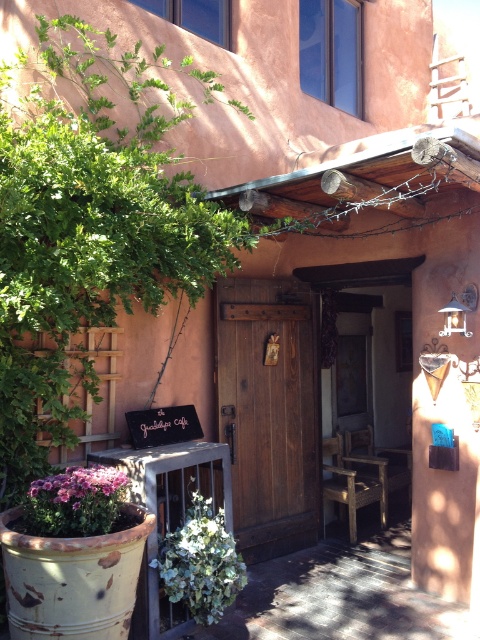
Does point (216, 282) come farther from viewer compared to point (28, 504)?

Yes, point (216, 282) is farther from viewer.

Where is `rustic wood door at center`? The image size is (480, 640). rustic wood door at center is located at coordinates (268, 412).

Who is more distant from viewer, (287, 531) or (126, 477)?

The point (287, 531) is behind.

Locate an element on the screen. The width and height of the screenshot is (480, 640). rustic wood door at center is located at coordinates (268, 412).

Can you confirm if rustic wood door at center is bigger than green leafy plant at lower center?

Yes.

Between rustic wood door at center and green leafy plant at lower center, which one appears on the left side from the viewer's perspective?

From the viewer's perspective, green leafy plant at lower center appears more on the left side.

Is point (305, 296) less distant than point (192, 504)?

No, (305, 296) is behind (192, 504).

Find the location of `rustic wood door at center`. rustic wood door at center is located at coordinates (268, 412).

Does green leafy plant at lower center appear on the right side of purple matte flowers at lower left?

Yes, green leafy plant at lower center is to the right of purple matte flowers at lower left.

Who is taller, green leafy plant at lower center or purple matte flowers at lower left?

Standing taller between the two is green leafy plant at lower center.

The width and height of the screenshot is (480, 640). Find the location of `green leafy plant at lower center`. green leafy plant at lower center is located at coordinates (201, 563).